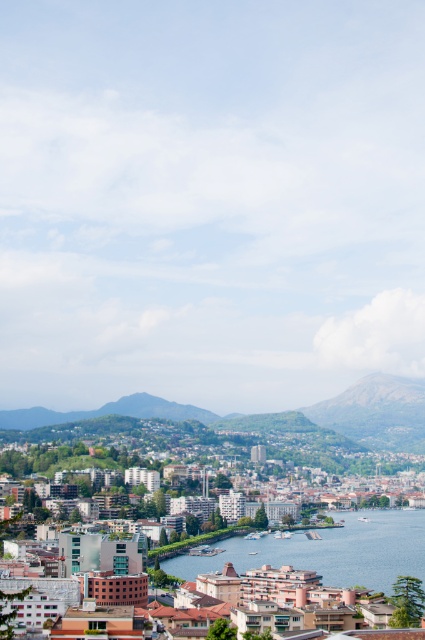
You are standing at the edge of the city looking towards the matte brown buildings at center. If you want to take a photo of them, would their distance of 203.38 meters affect the clarity of the photo?

The matte brown buildings at center are 203.38 meters away. This distance may reduce clarity if the camera doesn not have a zoom lens or image stabilization, but modern cameras can often capture clear images at this distance with proper settings.

You are a city planner analyzing the layout of this urban area. Given the presence of both matte brown buildings at center and clear blue water at center, which object occupies a greater area in the scene?

The matte brown buildings at center is larger in size than clear blue water at center, so the matte brown buildings at center occupies a greater area in the scene.